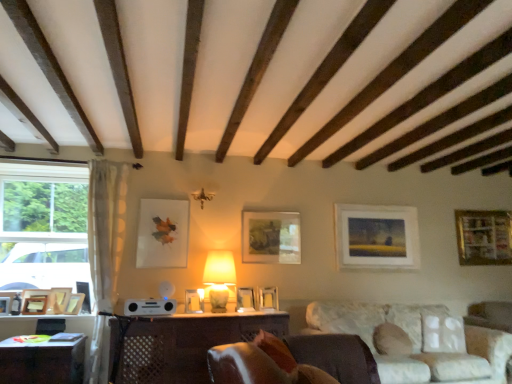
Question: Do you think matte white picture frame at center right, the 11th picture frame viewed from the left, is within matte beige lamp at center, or outside of it?

Choices:
 (A) outside
 (B) inside

Answer: (A)

Question: From a real-world perspective, is matte white picture frame at center right, the 11th picture frame viewed from the left, positioned above or below matte beige lamp at center?

Choices:
 (A) below
 (B) above

Answer: (B)

Question: Which object is the farthest from the matte white picture frame at center right, placed as the second picture frame when sorted from right to left?

Choices:
 (A) matte white picture frame at center, marked as the seventh picture frame in a right-to-left arrangement
 (B) matte white picture frame at center, placed as the 5th picture frame when sorted from right to left
 (C) matte white picture frame at center, the 7th picture frame from the left
 (D) wooden picture frame at right, the 1th picture frame viewed from the right
 (E) wooden picture frame at lower left, positioned as the third picture frame in left-to-right order

Answer: (E)

Question: Estimate the real-world distances between objects in this image. Which object is closer to the matte white picture frame at center, placed as the 5th picture frame when sorted from right to left?

Choices:
 (A) wooden table at center, the first table in the right-to-left sequence
 (B) brown leather swivel chair at lower right
 (C) matte white picture frame at center right, placed as the second picture frame when sorted from right to left
 (D) wooden picture frame at lower left, the 10th picture frame in the right-to-left sequence
 (E) white sheer curtain at left

Answer: (A)